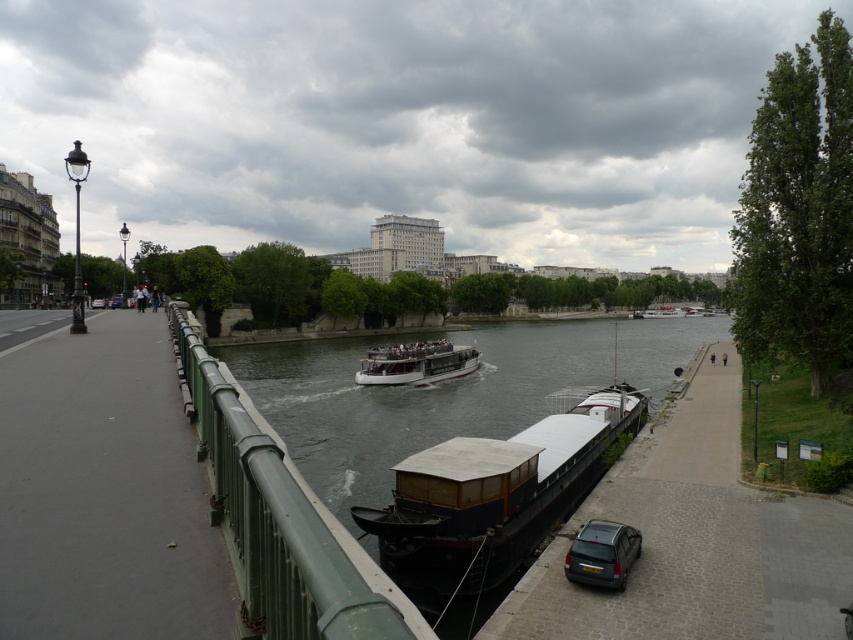
Question: Observing the image, what is the correct spatial positioning of dark brown wooden barge at center in reference to white polished wood boat at center?

Choices:
 (A) right
 (B) left

Answer: (A)

Question: Is dark brown wooden barge at center closer to camera compared to metallic gray hatchback at lower right?

Choices:
 (A) no
 (B) yes

Answer: (A)

Question: Which point is farther to the camera?

Choices:
 (A) (405, 348)
 (B) (314, 378)
 (C) (242, 499)
 (D) (399, 552)

Answer: (B)

Question: Which point is closer to the camera?

Choices:
 (A) green metal railing at left
 (B) dark brown wooden barge at center

Answer: (A)

Question: Does smooth dark water at center lie in front of metallic gray hatchback at lower right?

Choices:
 (A) yes
 (B) no

Answer: (B)

Question: Which point is farther to the camera?

Choices:
 (A) (596, 554)
 (B) (468, 449)
 (C) (248, 621)
 (D) (531, 396)

Answer: (D)